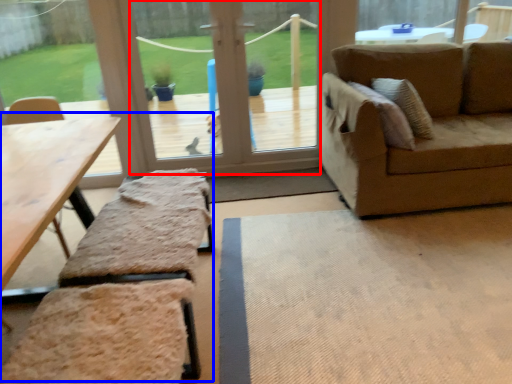
Question: Among these objects, which one is farthest to the camera, window screen (highlighted by a red box) or picnic table (highlighted by a blue box)?

Choices:
 (A) window screen
 (B) picnic table

Answer: (A)